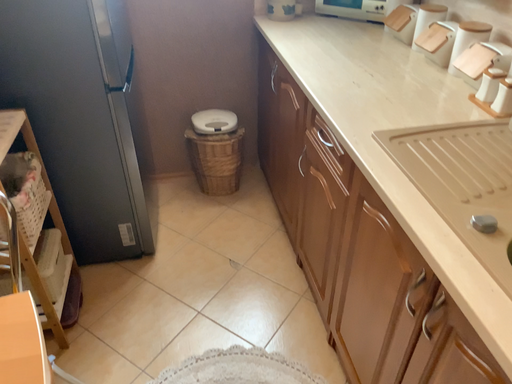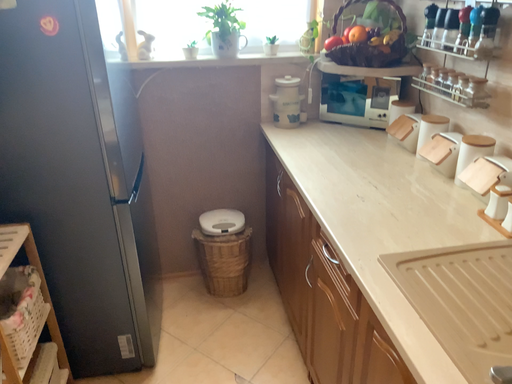
Question: Which way did the camera rotate in the video?

Choices:
 (A) rotated downward
 (B) rotated upward

Answer: (B)